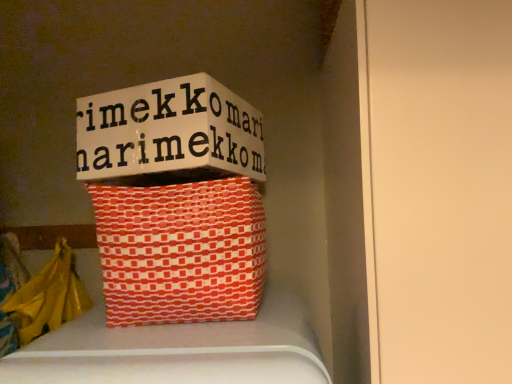
Question: Would you consider orange woven basket at center to be distant from white cardboard box at upper center?

Choices:
 (A) yes
 (B) no

Answer: (B)

Question: Does orange woven basket at center come in front of white cardboard box at upper center?

Choices:
 (A) yes
 (B) no

Answer: (A)

Question: Can you confirm if orange woven basket at center is positioned to the left of white cardboard box at upper center?

Choices:
 (A) yes
 (B) no

Answer: (B)

Question: From the image's perspective, is orange woven basket at center on top of white cardboard box at upper center?

Choices:
 (A) no
 (B) yes

Answer: (A)

Question: Is white cardboard box at upper center at the back of orange woven basket at center?

Choices:
 (A) no
 (B) yes

Answer: (A)

Question: In terms of width, does yellow plastic bag at lower left look wider or thinner when compared to white cardboard box at upper center?

Choices:
 (A) thin
 (B) wide

Answer: (A)

Question: From their relative heights in the image, would you say yellow plastic bag at lower left is taller or shorter than white cardboard box at upper center?

Choices:
 (A) short
 (B) tall

Answer: (B)

Question: From the image's perspective, is yellow plastic bag at lower left located above or below white cardboard box at upper center?

Choices:
 (A) below
 (B) above

Answer: (A)

Question: From a real-world perspective, is yellow plastic bag at lower left physically located above or below white cardboard box at upper center?

Choices:
 (A) above
 (B) below

Answer: (B)

Question: From their relative heights in the image, would you say yellow plastic bag at lower left is taller or shorter than orange woven basket at center?

Choices:
 (A) short
 (B) tall

Answer: (B)

Question: Relative to orange woven basket at center, is yellow plastic bag at lower left in front or behind?

Choices:
 (A) behind
 (B) front

Answer: (A)

Question: From the image's perspective, is yellow plastic bag at lower left positioned above or below orange woven basket at center?

Choices:
 (A) above
 (B) below

Answer: (B)

Question: In the image, is yellow plastic bag at lower left on the left side or the right side of orange woven basket at center?

Choices:
 (A) right
 (B) left

Answer: (B)

Question: Is orange woven basket at center taller or shorter than white cardboard box at upper center?

Choices:
 (A) tall
 (B) short

Answer: (A)

Question: Would you say orange woven basket at center is to the left or to the right of white cardboard box at upper center in the picture?

Choices:
 (A) right
 (B) left

Answer: (A)